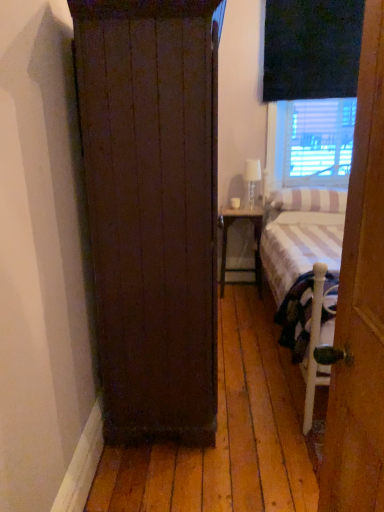
Image resolution: width=384 pixels, height=512 pixels. I want to click on free space in front of dark wood cupboard at left, so click(x=205, y=472).